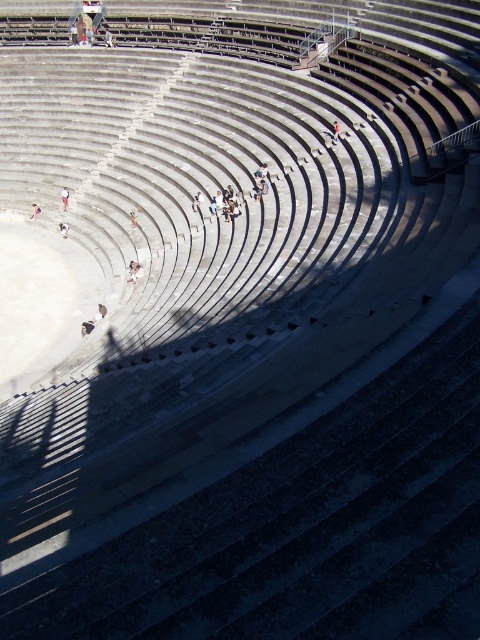
Question: Can you confirm if light brown fabric person at center is positioned to the left of light brown leather jacket at upper center?

Choices:
 (A) no
 (B) yes

Answer: (A)

Question: Which point is closer to the camera?

Choices:
 (A) (132, 218)
 (B) (137, 275)
 (C) (111, 40)
 (D) (100, 305)

Answer: (D)

Question: Is white fabric person at center bigger than light brown wooden bench at center?

Choices:
 (A) no
 (B) yes

Answer: (A)

Question: Among these objects, which one is farthest from the camera?

Choices:
 (A) light brown leather shoe at upper center
 (B) light brown leather bag at lower left
 (C) white fabric at center
 (D) light brown leather jacket at upper center

Answer: (D)

Question: Which object is the closest to the light brown leather jacket at upper center?

Choices:
 (A) light brown wooden chair at upper center
 (B) light brown leather bag at lower left

Answer: (A)

Question: From the image, what is the correct spatial relationship of light brown leather bag at lower left in relation to white fabric at center?

Choices:
 (A) below
 (B) above

Answer: (A)